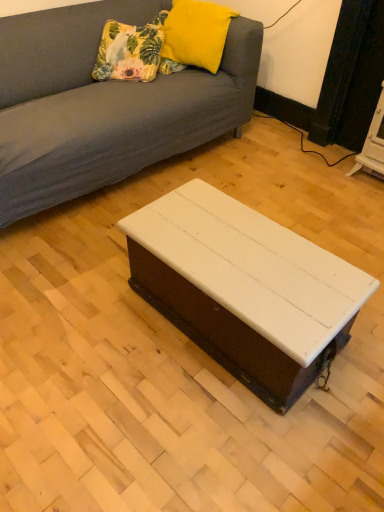
Where is `white painted wood coffee table at center`? The height and width of the screenshot is (512, 384). white painted wood coffee table at center is located at coordinates [x=244, y=288].

Which object is positioned more to the left, white painted wood coffee table at center or floral fabric cushion at upper left, the 1th pillow when ordered from left to right?

floral fabric cushion at upper left, the 1th pillow when ordered from left to right, is more to the left.

Is white painted wood coffee table at center surrounding floral fabric cushion at upper left, arranged as the second pillow when viewed from the right?

No, floral fabric cushion at upper left, arranged as the second pillow when viewed from the right, is not inside white painted wood coffee table at center.

Is point (259, 237) behind point (126, 42)?

No, it is in front of (126, 42).

Based on the photo, which of these two, white painted wood coffee table at center or floral fabric cushion at upper left, arranged as the second pillow when viewed from the right, is thinner?

With smaller width is floral fabric cushion at upper left, arranged as the second pillow when viewed from the right.

Is floral fabric cushion at upper left, arranged as the second pillow when viewed from the right, inside yellow fuzzy pillow at upper center, which appears as the second pillow when viewed from the left?

No, floral fabric cushion at upper left, arranged as the second pillow when viewed from the right, is not a part of yellow fuzzy pillow at upper center, which appears as the second pillow when viewed from the left.

In terms of width, does yellow fuzzy pillow at upper center, marked as the first pillow in a right-to-left arrangement, look wider or thinner when compared to floral fabric cushion at upper left, arranged as the second pillow when viewed from the right?

Considering their sizes, yellow fuzzy pillow at upper center, marked as the first pillow in a right-to-left arrangement, looks slimmer than floral fabric cushion at upper left, arranged as the second pillow when viewed from the right.

Between yellow fuzzy pillow at upper center, marked as the first pillow in a right-to-left arrangement, and floral fabric cushion at upper left, arranged as the second pillow when viewed from the right, which one is positioned in front?

yellow fuzzy pillow at upper center, marked as the first pillow in a right-to-left arrangement.

Is yellow fuzzy pillow at upper center, which appears as the second pillow when viewed from the left, to the left of floral fabric cushion at upper left, arranged as the second pillow when viewed from the right, from the viewer's perspective?

No.

Does white painted wood coffee table at center have a lesser height compared to yellow fuzzy pillow at upper center, which appears as the second pillow when viewed from the left?

Incorrect, the height of white painted wood coffee table at center does not fall short of that of yellow fuzzy pillow at upper center, which appears as the second pillow when viewed from the left.

In the scene shown: Is white painted wood coffee table at center positioned with its back to yellow fuzzy pillow at upper center, which appears as the second pillow when viewed from the left?

No, white painted wood coffee table at center's orientation is not away from yellow fuzzy pillow at upper center, which appears as the second pillow when viewed from the left.

What's the angular difference between white painted wood coffee table at center and yellow fuzzy pillow at upper center, which appears as the second pillow when viewed from the left,'s facing directions?

159 degrees.

In the scene shown: Is white painted wood coffee table at center in contact with yellow fuzzy pillow at upper center, marked as the first pillow in a right-to-left arrangement?

There is a gap between white painted wood coffee table at center and yellow fuzzy pillow at upper center, marked as the first pillow in a right-to-left arrangement.

Which of these two, yellow fuzzy pillow at upper center, marked as the first pillow in a right-to-left arrangement, or white painted wood coffee table at center, is smaller?

With smaller size is yellow fuzzy pillow at upper center, marked as the first pillow in a right-to-left arrangement.

Is yellow fuzzy pillow at upper center, which appears as the second pillow when viewed from the left, not inside white painted wood coffee table at center?

Yes.

How many degrees apart are the facing directions of yellow fuzzy pillow at upper center, which appears as the second pillow when viewed from the left, and white painted wood coffee table at center?

The angle between the facing direction of yellow fuzzy pillow at upper center, which appears as the second pillow when viewed from the left, and the facing direction of white painted wood coffee table at center is 159 degrees.

Based on the photo, between yellow fuzzy pillow at upper center, marked as the first pillow in a right-to-left arrangement, and white painted wood coffee table at center, which one has less height?

yellow fuzzy pillow at upper center, marked as the first pillow in a right-to-left arrangement.

Could you tell me if floral fabric cushion at upper left, arranged as the second pillow when viewed from the right, is facing white painted wood coffee table at center?

No, floral fabric cushion at upper left, arranged as the second pillow when viewed from the right, is not facing towards white painted wood coffee table at center.

Which is in front, point (151, 39) or point (184, 276)?

Positioned in front is point (184, 276).

Which of these two, floral fabric cushion at upper left, the 1th pillow when ordered from left to right, or white painted wood coffee table at center, is wider?

Wider between the two is white painted wood coffee table at center.

From the image's perspective, is floral fabric cushion at upper left, arranged as the second pillow when viewed from the right, beneath white painted wood coffee table at center?

No.

Is floral fabric cushion at upper left, arranged as the second pillow when viewed from the right, facing away from yellow fuzzy pillow at upper center, marked as the first pillow in a right-to-left arrangement?

No, floral fabric cushion at upper left, arranged as the second pillow when viewed from the right, is not facing away from yellow fuzzy pillow at upper center, marked as the first pillow in a right-to-left arrangement.

Is floral fabric cushion at upper left, the 1th pillow when ordered from left to right, outside of yellow fuzzy pillow at upper center, which appears as the second pillow when viewed from the left?

Yes, floral fabric cushion at upper left, the 1th pillow when ordered from left to right, is not within yellow fuzzy pillow at upper center, which appears as the second pillow when viewed from the left.

Is floral fabric cushion at upper left, the 1th pillow when ordered from left to right, wider or thinner than yellow fuzzy pillow at upper center, marked as the first pillow in a right-to-left arrangement?

Clearly, floral fabric cushion at upper left, the 1th pillow when ordered from left to right, has more width compared to yellow fuzzy pillow at upper center, marked as the first pillow in a right-to-left arrangement.

Is point (147, 28) more distant than point (230, 15)?

Yes, it is behind point (230, 15).

This screenshot has height=512, width=384. Identify the location of coffee table lying below the floral fabric cushion at upper left, the 1th pillow when ordered from left to right (from the image's perspective). (244, 288).

Find the location of a particular element. pillow on the right of floral fabric cushion at upper left, the 1th pillow when ordered from left to right is located at coordinates (196, 33).

From the image, which object appears to be nearer to yellow fuzzy pillow at upper center, marked as the first pillow in a right-to-left arrangement, white painted wood coffee table at center or floral fabric cushion at upper left, the 1th pillow when ordered from left to right?

floral fabric cushion at upper left, the 1th pillow when ordered from left to right, lies closer to yellow fuzzy pillow at upper center, marked as the first pillow in a right-to-left arrangement, than the other object.

Estimate the real-world distances between objects in this image. Which object is further from yellow fuzzy pillow at upper center, which appears as the second pillow when viewed from the left, floral fabric cushion at upper left, the 1th pillow when ordered from left to right, or white painted wood coffee table at center?

white painted wood coffee table at center is further to yellow fuzzy pillow at upper center, which appears as the second pillow when viewed from the left.

Looking at the image, which one is located further to floral fabric cushion at upper left, arranged as the second pillow when viewed from the right, yellow fuzzy pillow at upper center, marked as the first pillow in a right-to-left arrangement, or white painted wood coffee table at center?

white painted wood coffee table at center is further to floral fabric cushion at upper left, arranged as the second pillow when viewed from the right.

Looking at the image, which one is located closer to white painted wood coffee table at center, floral fabric cushion at upper left, arranged as the second pillow when viewed from the right, or yellow fuzzy pillow at upper center, marked as the first pillow in a right-to-left arrangement?

floral fabric cushion at upper left, arranged as the second pillow when viewed from the right, lies closer to white painted wood coffee table at center than the other object.

From the image, which object appears to be farther from floral fabric cushion at upper left, the 1th pillow when ordered from left to right, white painted wood coffee table at center or yellow fuzzy pillow at upper center, marked as the first pillow in a right-to-left arrangement?

The object further to floral fabric cushion at upper left, the 1th pillow when ordered from left to right, is white painted wood coffee table at center.

Estimate the real-world distances between objects in this image. Which object is further from white painted wood coffee table at center, yellow fuzzy pillow at upper center, which appears as the second pillow when viewed from the left, or floral fabric cushion at upper left, the 1th pillow when ordered from left to right?

yellow fuzzy pillow at upper center, which appears as the second pillow when viewed from the left, is further to white painted wood coffee table at center.

Where is `pillow between yellow fuzzy pillow at upper center, marked as the first pillow in a right-to-left arrangement, and white painted wood coffee table at center, in the vertical direction`? The image size is (384, 512). pillow between yellow fuzzy pillow at upper center, marked as the first pillow in a right-to-left arrangement, and white painted wood coffee table at center, in the vertical direction is located at coordinates (131, 51).